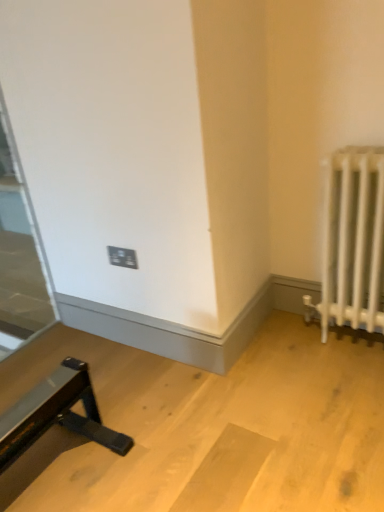
Question: Is transparent glass door at left in front of or behind black plastic outlet at center in the image?

Choices:
 (A) front
 (B) behind

Answer: (A)

Question: In terms of height, does transparent glass door at left look taller or shorter compared to black plastic outlet at center?

Choices:
 (A) tall
 (B) short

Answer: (A)

Question: Which is nearer to the black plastic outlet at center?

Choices:
 (A) white metal radiator at right
 (B) transparent glass door at left

Answer: (A)

Question: Based on their relative distances, which object is nearer to the white metal radiator at right?

Choices:
 (A) transparent glass door at left
 (B) black plastic outlet at center

Answer: (B)